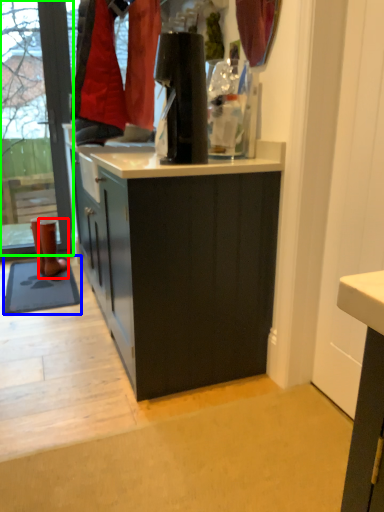
Question: Considering the real-world distances, which object is farthest from footwear (highlighted by a red box)? mat (highlighted by a blue box) or shop window (highlighted by a green box)?

Choices:
 (A) mat
 (B) shop window

Answer: (B)